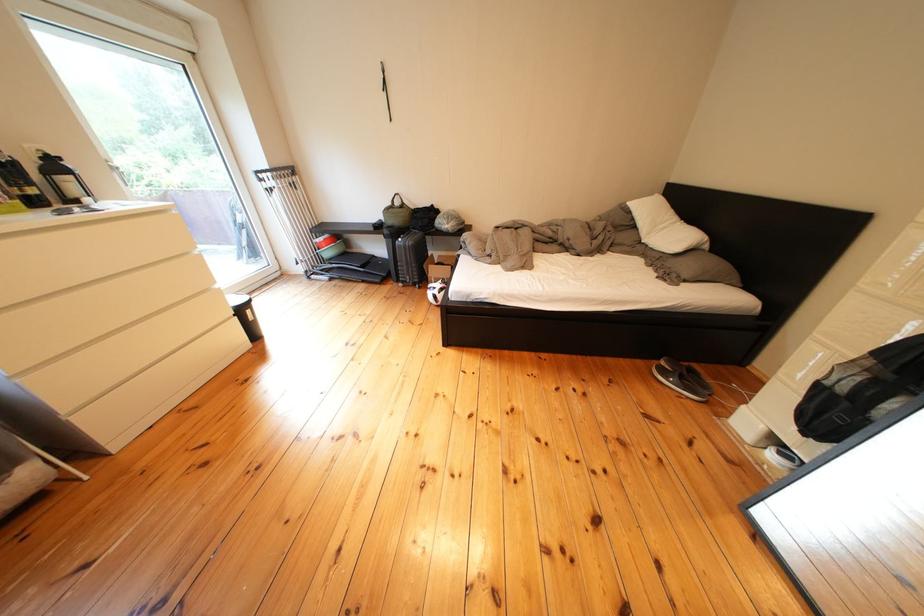
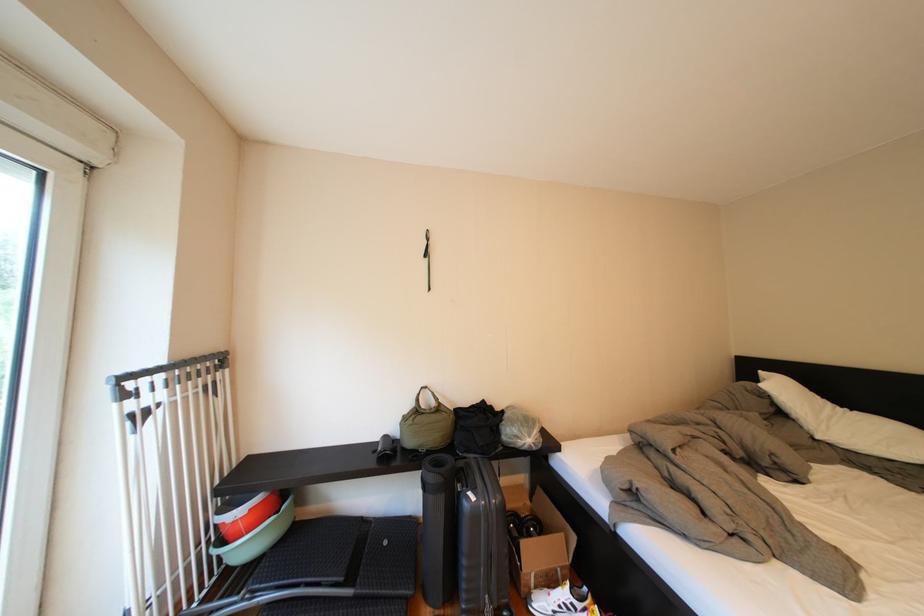
Where in the second image is the point corresponding to (447,275) from the first image?

(544, 557)